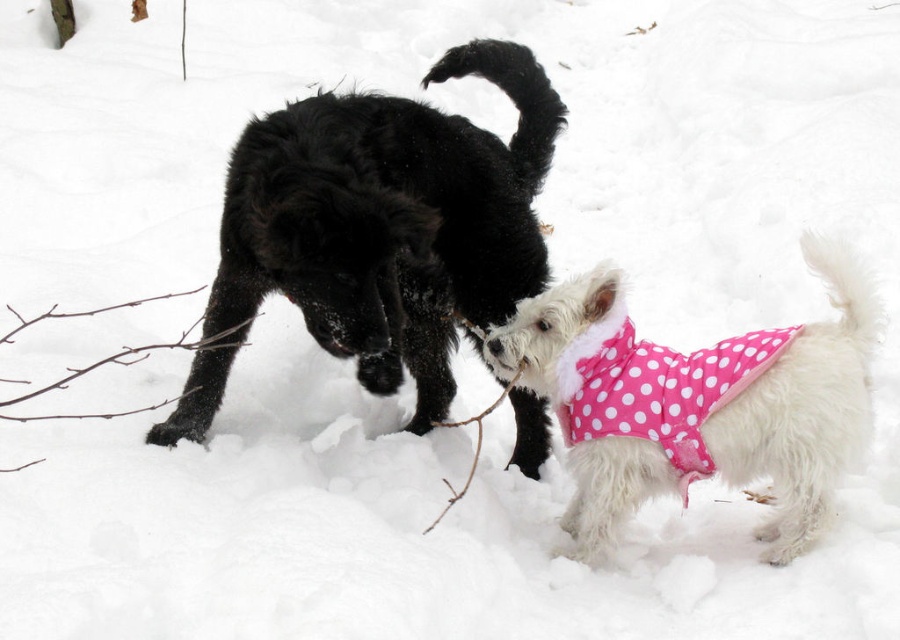
You are a photographer trying to capture the dogs in the scene. You want to ensure that both the shiny black fur at center and the pink polka dot fabric at right are clearly visible in your photo. Based on their positions, which object should you focus on first to ensure both are in focus?

Since the shiny black fur at center is in front of the pink polka dot fabric at right, you should focus on the pink polka dot fabric at right first. This way, both objects will be in focus as the shiny black fur at center is closer to the camera.

You are a photographer trying to capture the dogs in the snow. You notice a point at coordinates [392,220] in the image. What is located at this point?

The point at coordinates [392,220] indicates shiny black fur at center.

You are a photographer trying to capture the dogs in the snow. You notice a point labeled as point (392,220) in your camera viewfinder. Where is this point located in relation to the dogs?

The point (392,220) corresponds to the shiny black fur at center, which is part of the larger dog on the left.